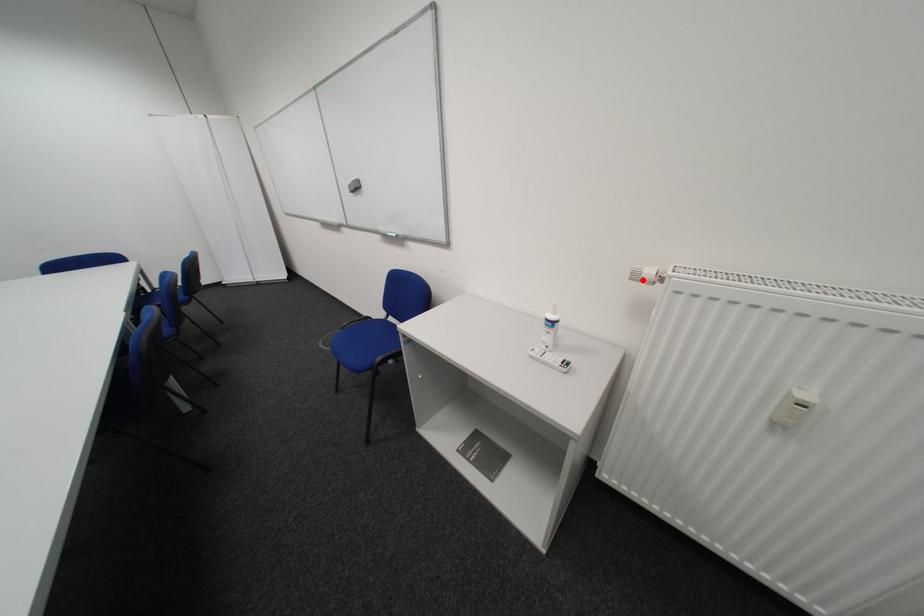
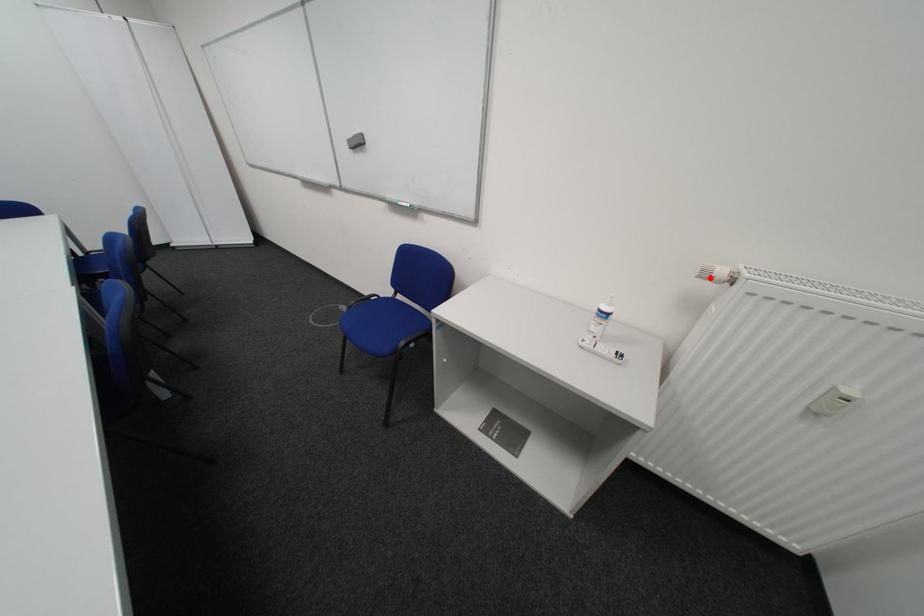
I am providing you with two images of the same scene from different viewpoints. A red point is marked on the first image and another point is marked on the second image. Does the point marked in image1 correspond to the same location as the one in image2?

Yes